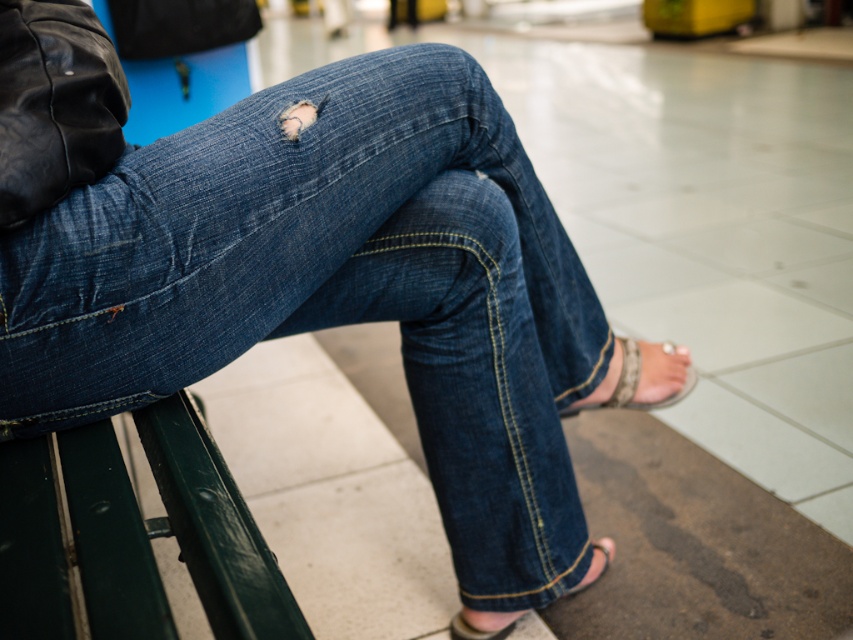
This screenshot has width=853, height=640. What do you see at coordinates (643, 378) in the screenshot?
I see `leather textured sandal at lower right` at bounding box center [643, 378].

This screenshot has width=853, height=640. Identify the location of leather textured sandal at lower right. (643, 378).

Does denim at left appear over pink fabric sandal at lower right?

Yes.

Find the location of a particular element. Image resolution: width=853 pixels, height=640 pixels. denim at left is located at coordinates (335, 289).

What are the coordinates of `denim at left` in the screenshot? It's located at (335, 289).

Is denim at left closer to the viewer compared to leather textured sandal at lower right?

That is True.

What do you see at coordinates (335, 289) in the screenshot? The image size is (853, 640). I see `denim at left` at bounding box center [335, 289].

Which is in front, point (103, 241) or point (648, 344)?

Point (103, 241) is more forward.

Locate an element on the screen. The width and height of the screenshot is (853, 640). denim at left is located at coordinates (335, 289).